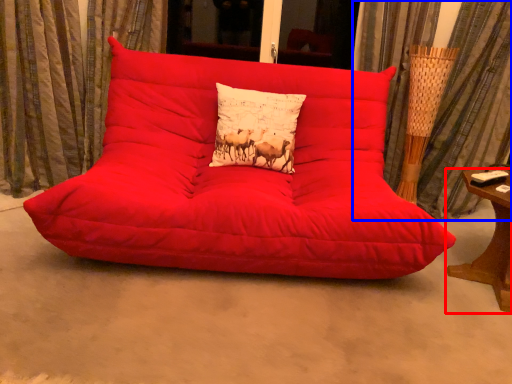
Question: Among these objects, which one is nearest to the camera, table (highlighted by a red box) or curtain (highlighted by a blue box)?

Choices:
 (A) table
 (B) curtain

Answer: (A)